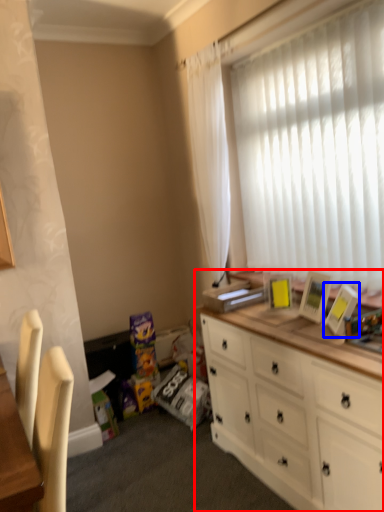
Question: Which object appears closest to the camera in this image, cabinetry (highlighted by a red box) or picture frame (highlighted by a blue box)?

Choices:
 (A) cabinetry
 (B) picture frame

Answer: (A)